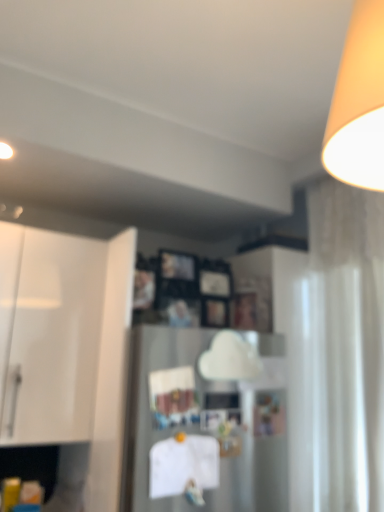
Question: Is point (157, 418) closer or farther from the camera than point (59, 396)?

Choices:
 (A) closer
 (B) farther

Answer: (A)

Question: From the image's perspective, relative to white glossy cabinet at left, is satin silver refrigerator at center above or below?

Choices:
 (A) below
 (B) above

Answer: (A)

Question: Which of these objects is positioned farthest from the satin silver refrigerator at center?

Choices:
 (A) white glossy cabinet at left
 (B) white sheer curtain at right

Answer: (A)

Question: Estimate the real-world distances between objects in this image. Which object is closer to the white glossy cabinet at left?

Choices:
 (A) white sheer curtain at right
 (B) satin silver refrigerator at center

Answer: (B)